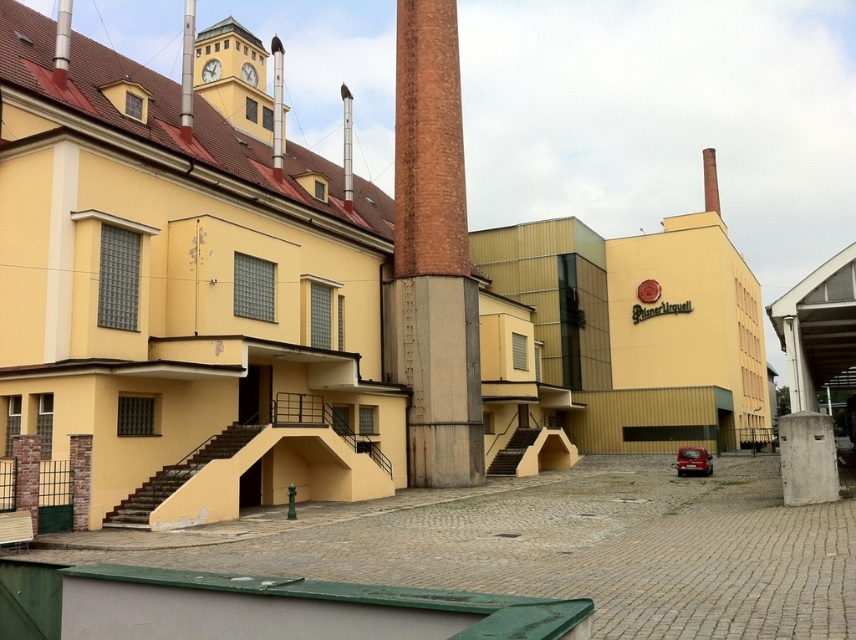
You are an architect inspecting the building. You notice the concrete at center and the brown brick chimney at upper center. Which of these two structures has a greater horizontal width?

The brown brick chimney at upper center has a greater horizontal width than the concrete at center.

You are standing in front of the Plze?sk? Prazdroj brewery. You want to place a small potted plant exactly at the center of the concrete at center. What are the coordinates where you should place it?

The coordinates for the concrete at center are point (807, 458), so you should place the small potted plant at those coordinates.